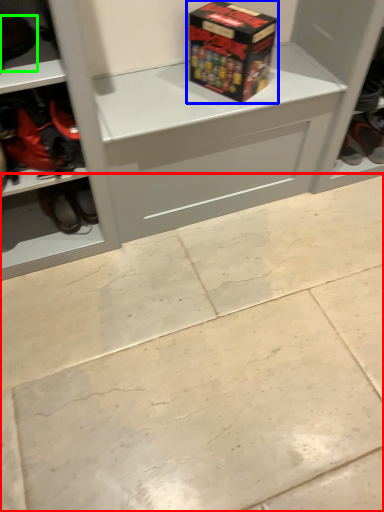
Question: Based on their relative distances, which object is nearer to concrete (highlighted by a red box)? Choose from box (highlighted by a blue box) and footwear (highlighted by a green box).

Choices:
 (A) box
 (B) footwear

Answer: (A)